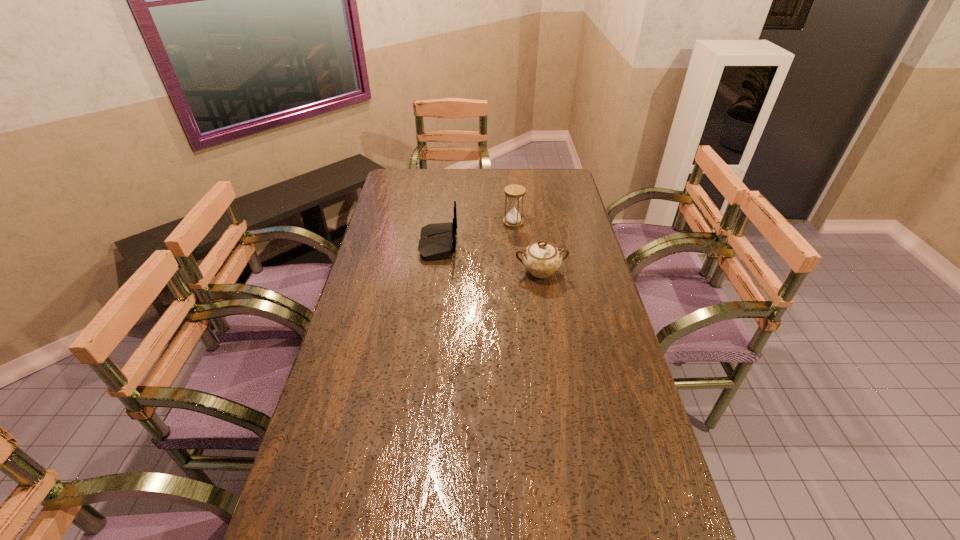
You are a GUI agent. You are given a task and a screenshot of the screen. Output one action in this format:
    pyautogui.click(x=<x>, y=<y>)
    Task: Click on the vacant space at the far right corner of the desktop
    
    Given the screenshot: What is the action you would take?
    pyautogui.click(x=569, y=179)

The width and height of the screenshot is (960, 540). In order to click on free space between the chinaware and the leftmost object in this screenshot , I will do `click(490, 258)`.

Locate an element on the screen. free space between the router and the hourglass is located at coordinates (475, 234).

Find the location of `free space between the leftmost object and the chinaware`. free space between the leftmost object and the chinaware is located at coordinates (490, 258).

What are the coordinates of `vacant space that is in between the leftmost object and the hourglass` in the screenshot? It's located at (475, 234).

Locate an element on the screen. The image size is (960, 540). vacant space that is in between the leftmost object and the chinaware is located at coordinates (490, 258).

Image resolution: width=960 pixels, height=540 pixels. Identify the location of free space that is in between the router and the chinaware. (490, 258).

Locate an element on the screen. This screenshot has height=540, width=960. the closest object relative to the hourglass is located at coordinates (438, 240).

This screenshot has height=540, width=960. In order to click on object that is the second closest one to the leftmost object in this screenshot , I will do `click(541, 259)`.

This screenshot has height=540, width=960. In order to click on free spot that satisfies the following two spatial constraints: 1. on the front side of the hourglass; 2. on the back of the leftmost object in this screenshot , I will do `click(516, 245)`.